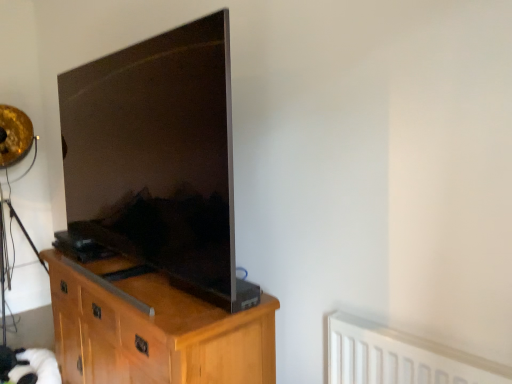
Question: Should I look upward or downward to see matte black tv at left?

Choices:
 (A) down
 (B) up

Answer: (B)

Question: Is matte black tv at left far from white plastic radiator at lower right?

Choices:
 (A) no
 (B) yes

Answer: (A)

Question: Does matte black tv at left come in front of white plastic radiator at lower right?

Choices:
 (A) yes
 (B) no

Answer: (B)

Question: From a real-world perspective, does matte black tv at left sit lower than white plastic radiator at lower right?

Choices:
 (A) no
 (B) yes

Answer: (A)

Question: Considering the relative positions of matte black tv at left and white plastic radiator at lower right in the image provided, is matte black tv at left behind white plastic radiator at lower right?

Choices:
 (A) yes
 (B) no

Answer: (A)

Question: From the image's perspective, does matte black tv at left appear lower than white plastic radiator at lower right?

Choices:
 (A) yes
 (B) no

Answer: (B)

Question: Is matte black tv at left facing away from white plastic radiator at lower right?

Choices:
 (A) no
 (B) yes

Answer: (A)

Question: Is white plastic radiator at lower right oriented towards matte black tv at left?

Choices:
 (A) no
 (B) yes

Answer: (A)

Question: From the image's perspective, is white plastic radiator at lower right above matte black tv at left?

Choices:
 (A) no
 (B) yes

Answer: (A)

Question: Is white plastic radiator at lower right to the left of matte black tv at left from the viewer's perspective?

Choices:
 (A) yes
 (B) no

Answer: (B)

Question: From the image's perspective, is white plastic radiator at lower right below matte black tv at left?

Choices:
 (A) no
 (B) yes

Answer: (B)

Question: From a real-world perspective, is white plastic radiator at lower right on top of matte black tv at left?

Choices:
 (A) yes
 (B) no

Answer: (B)

Question: Is white plastic radiator at lower right not near matte black tv at left?

Choices:
 (A) no
 (B) yes

Answer: (A)

Question: Could you tell me if light wood cabinet at center is turned towards white plastic radiator at lower right?

Choices:
 (A) yes
 (B) no

Answer: (B)